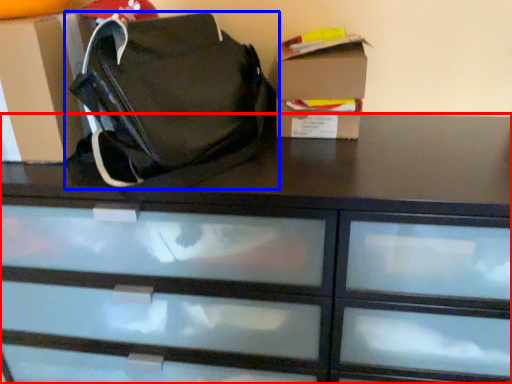
Question: Which of the following is the closest to the observer, chest of drawers (highlighted by a red box) or handbag (highlighted by a blue box)?

Choices:
 (A) chest of drawers
 (B) handbag

Answer: (B)